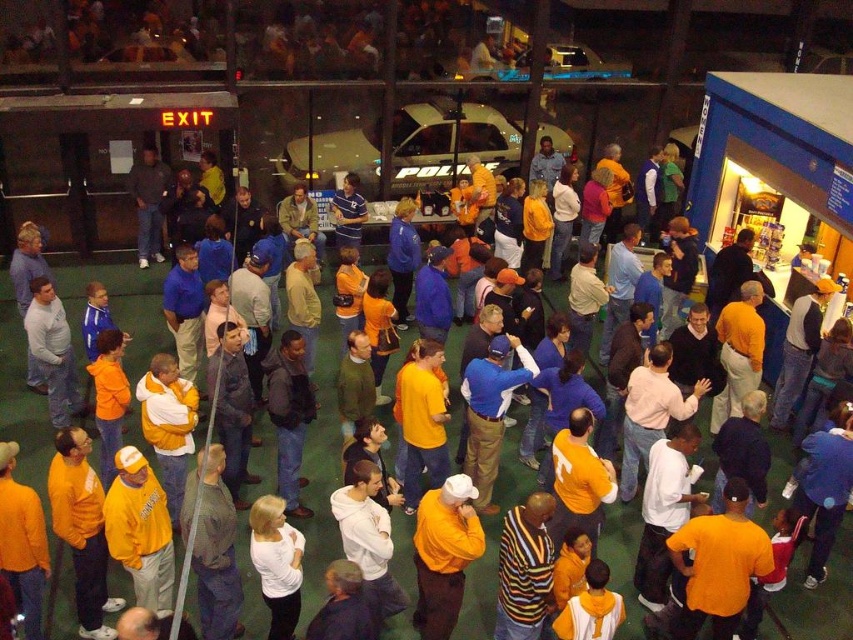
In the image of the lively indoor sports event, there is a point labeled at coordinates (444, 554). What object is located at this point?

The point at coordinates (444, 554) corresponds to the matte yellow shirt at center.

You are standing at the entrance of the hall and want to see both the matte yellow shirt at center and the white matte shirt at center. Which shirt will appear closer to you when looking towards the center of the hall?

The matte yellow shirt at center will appear closer to you because the white matte shirt at center is positioned behind it.